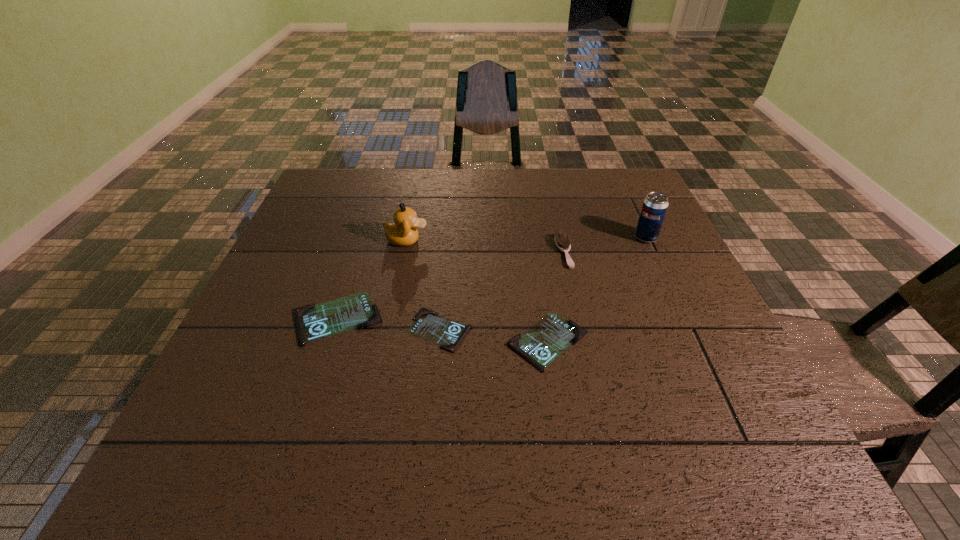
The height and width of the screenshot is (540, 960). I want to click on vacant space located 0.240m on the right of the second shortest identity card, so click(x=703, y=342).

Locate an element on the screen. The image size is (960, 540). free point located on the left of the scrubbing brush is located at coordinates (529, 252).

I want to click on free spot located 0.250m on the face of the duckling, so click(x=520, y=240).

The height and width of the screenshot is (540, 960). I want to click on vacant point located 0.060m on the left of the beer can, so click(x=612, y=238).

This screenshot has width=960, height=540. Identify the location of object located at the left edge. (314, 322).

Locate an element on the screen. The width and height of the screenshot is (960, 540). object at the right edge is located at coordinates pos(653,211).

This screenshot has width=960, height=540. Identify the location of free space at the far edge of the desktop. click(x=388, y=187).

The image size is (960, 540). Find the location of `vacant space at the near edge of the desktop`. vacant space at the near edge of the desktop is located at coordinates (430, 402).

This screenshot has height=540, width=960. In order to click on free region at the left edge of the desktop in this screenshot , I will do `click(262, 341)`.

Where is `vacant area at the right edge`? The image size is (960, 540). vacant area at the right edge is located at coordinates (635, 236).